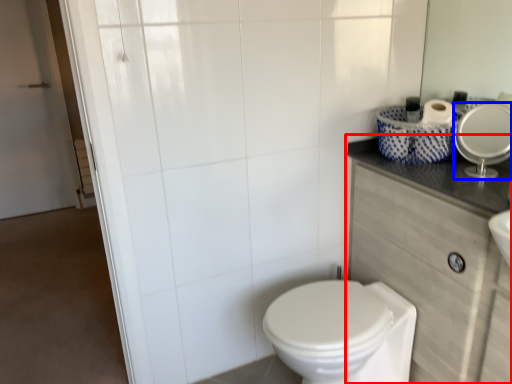
Question: Which object appears farthest to the camera in this image, counter top (highlighted by a red box) or mirror (highlighted by a blue box)?

Choices:
 (A) counter top
 (B) mirror

Answer: (B)